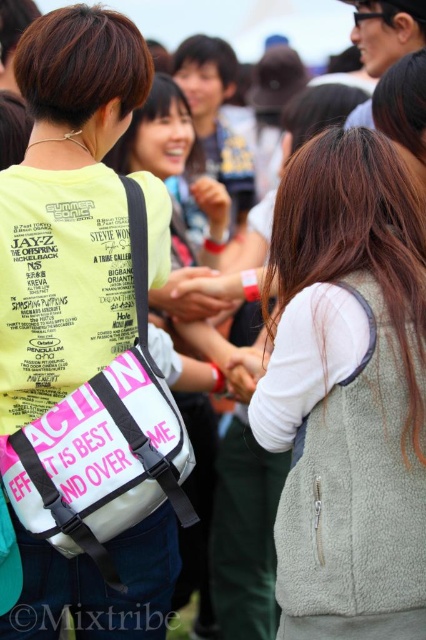
You are standing in the middle of the crowd at the festival and notice two points in the scene. The first point is at coordinates point (336, 454) and the second is at point (215, 182). Which point is nearer to you?

Point (336, 454) is closer to the viewer than point .286, 0.505.

You are a photographer at the festival, and you need to capture a closeup of both the smooth skin hand at center and the white matte hand at center in the same frame. Considering their height difference, which hand should you focus on to ensure both are visible without cropping?

The smooth skin hand at center is much taller than the white matte hand at center, so to capture both in the same frame without cropping, focus on the smooth skin hand at center as the primary subject and position the camera slightly lower to include the white matte hand at center below it.

You are a photographer at the festival trying to capture a photo of both individuals. You notice two points marked in the scene. The first point is at coordinates point (x=201, y=515) and the second point is at coordinates point (x=209, y=301). Based on their positions, which point is closer to the photographer?

Point (x=209, y=301) is closer to the photographer since it is in front of point (x=201, y=515) according to their spatial arrangement.